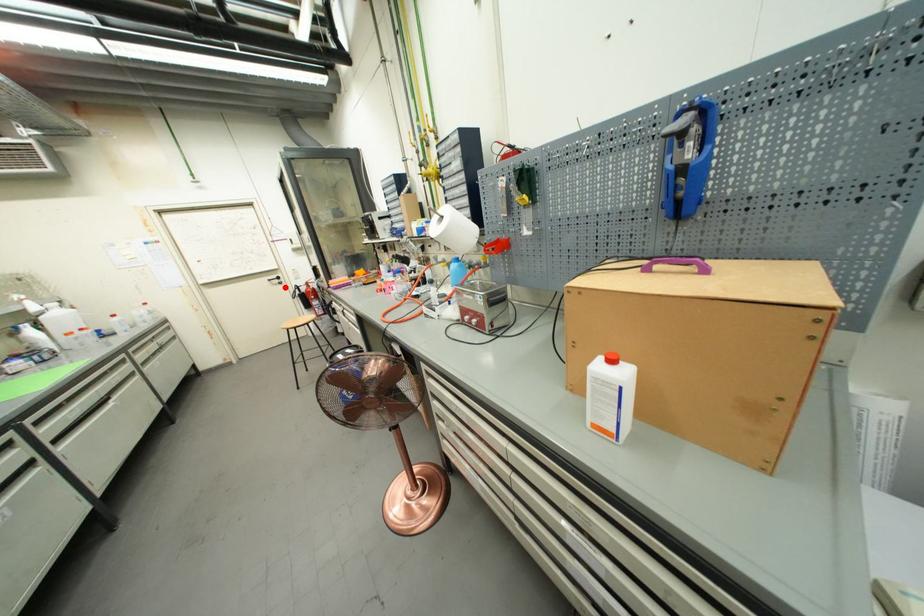
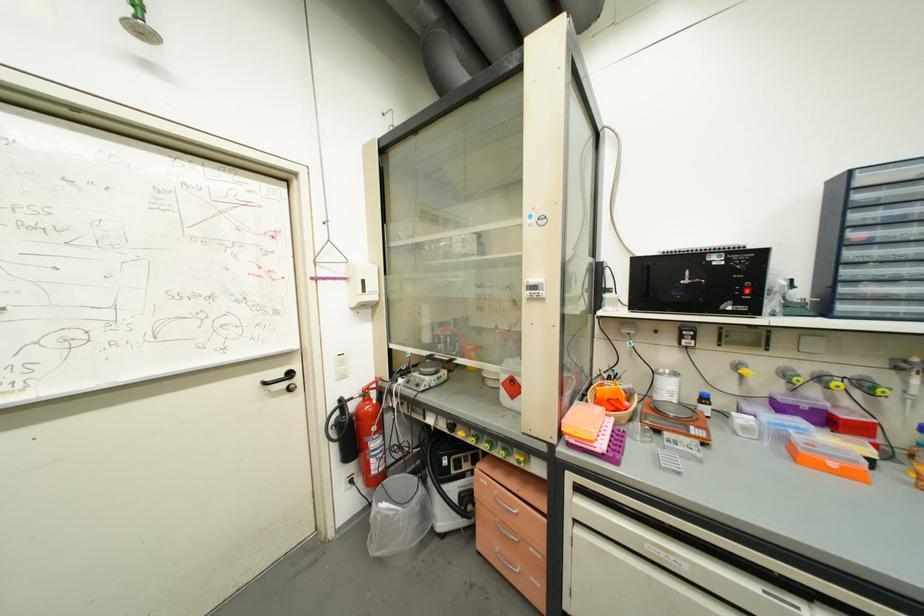
Find the pixel in the second image that matches the highlighted location in the first image.

(293, 398)